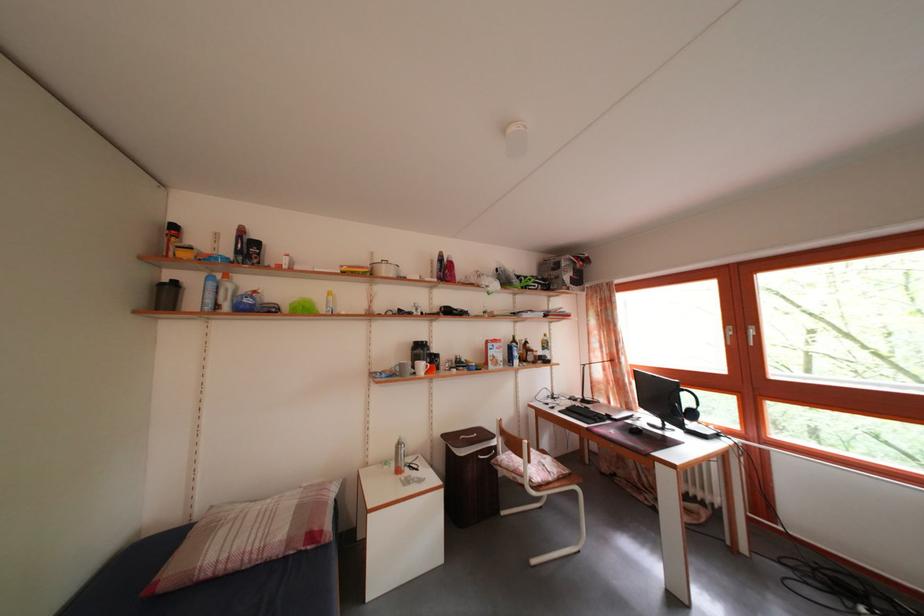
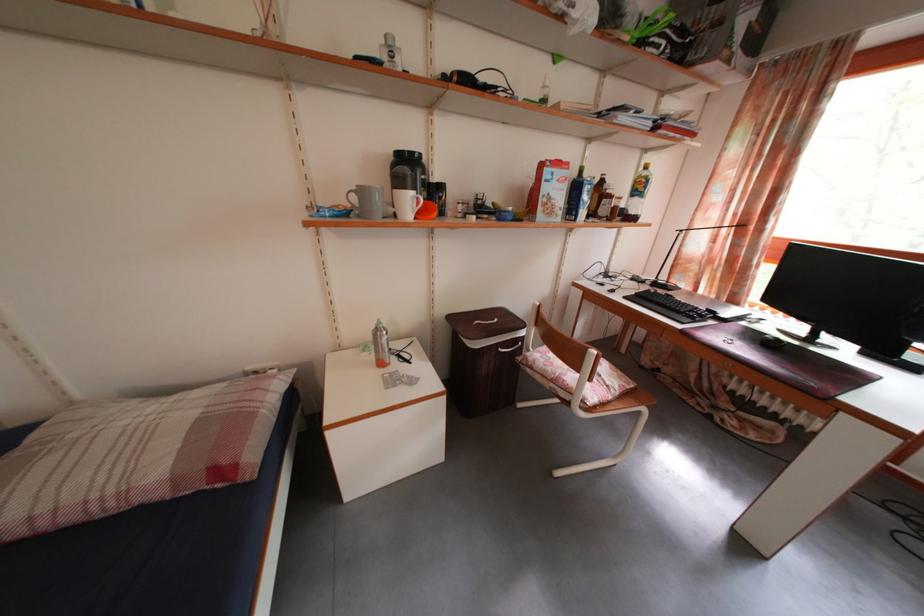
Where in the second image is the point corresponding to the point at 553,331 from the first image?

(643, 161)